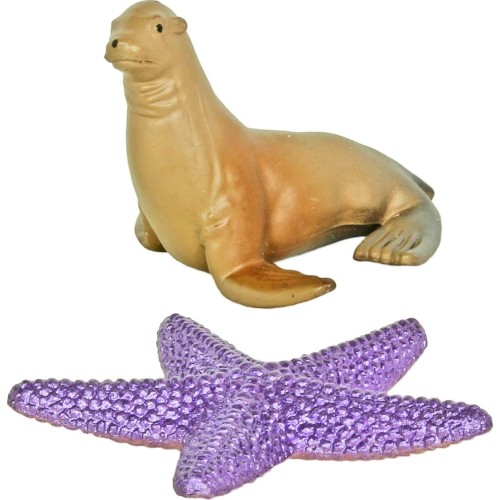
The height and width of the screenshot is (500, 500). Identify the location of chest. (166, 189).